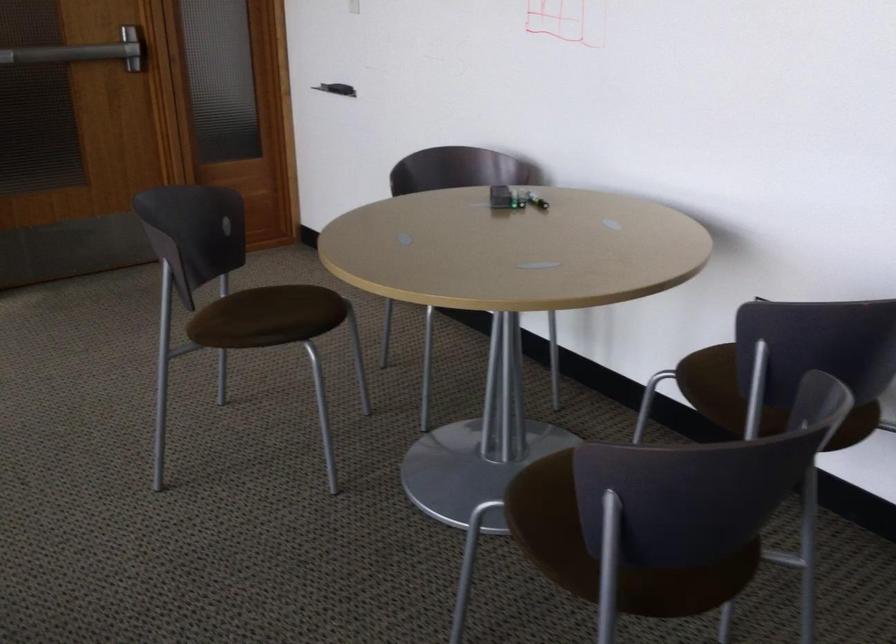
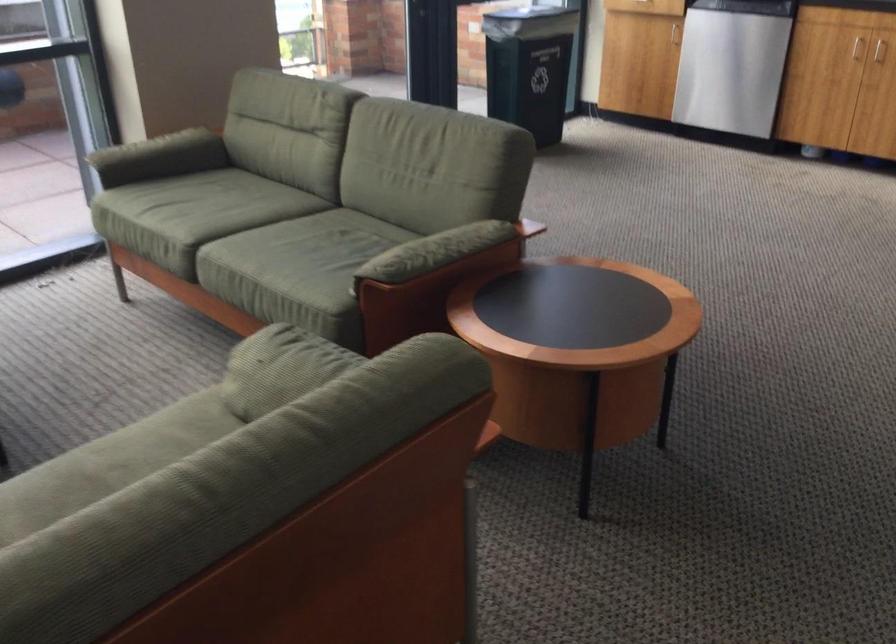
Based on the photo, based on the continuous images, in which direction is the camera rotating?

The camera's rotation is toward left-down.